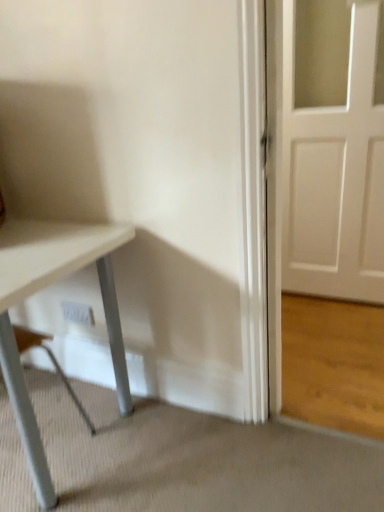
Question: Is white matte table at lower left positioned far away from white plastic electric outlet at lower center?

Choices:
 (A) yes
 (B) no

Answer: (B)

Question: Can you confirm if white matte table at lower left is smaller than white plastic electric outlet at lower center?

Choices:
 (A) yes
 (B) no

Answer: (B)

Question: Can you see white matte table at lower left touching white plastic electric outlet at lower center?

Choices:
 (A) no
 (B) yes

Answer: (A)

Question: Can you confirm if white matte table at lower left is positioned to the right of white plastic electric outlet at lower center?

Choices:
 (A) no
 (B) yes

Answer: (A)

Question: From the image's perspective, is white matte table at lower left located above white plastic electric outlet at lower center?

Choices:
 (A) yes
 (B) no

Answer: (B)

Question: Can you confirm if white matte table at lower left is positioned to the left of white plastic electric outlet at lower center?

Choices:
 (A) yes
 (B) no

Answer: (A)

Question: Is white plastic electric outlet at lower center positioned behind white matte table at lower left?

Choices:
 (A) yes
 (B) no

Answer: (A)

Question: From the image's perspective, would you say white plastic electric outlet at lower center is positioned over white matte table at lower left?

Choices:
 (A) no
 (B) yes

Answer: (B)

Question: Could you tell me if white plastic electric outlet at lower center is facing white matte table at lower left?

Choices:
 (A) no
 (B) yes

Answer: (B)

Question: From a real-world perspective, is white plastic electric outlet at lower center positioned over white matte table at lower left based on gravity?

Choices:
 (A) no
 (B) yes

Answer: (A)

Question: From a real-world perspective, is white plastic electric outlet at lower center below white matte table at lower left?

Choices:
 (A) yes
 (B) no

Answer: (A)

Question: Is white plastic electric outlet at lower center smaller than white matte table at lower left?

Choices:
 (A) no
 (B) yes

Answer: (B)

Question: Is white matte table at lower left taller or shorter than white plastic electric outlet at lower center?

Choices:
 (A) tall
 (B) short

Answer: (A)